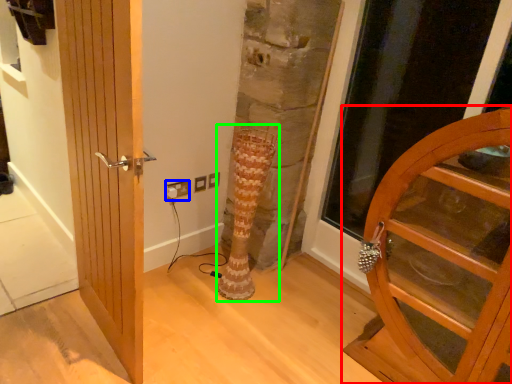
Question: Estimate the real-world distances between objects in this image. Which object is closer to door (highlighted by a red box), electric outlet (highlighted by a blue box) or tree trunk (highlighted by a green box)?

Choices:
 (A) electric outlet
 (B) tree trunk

Answer: (B)